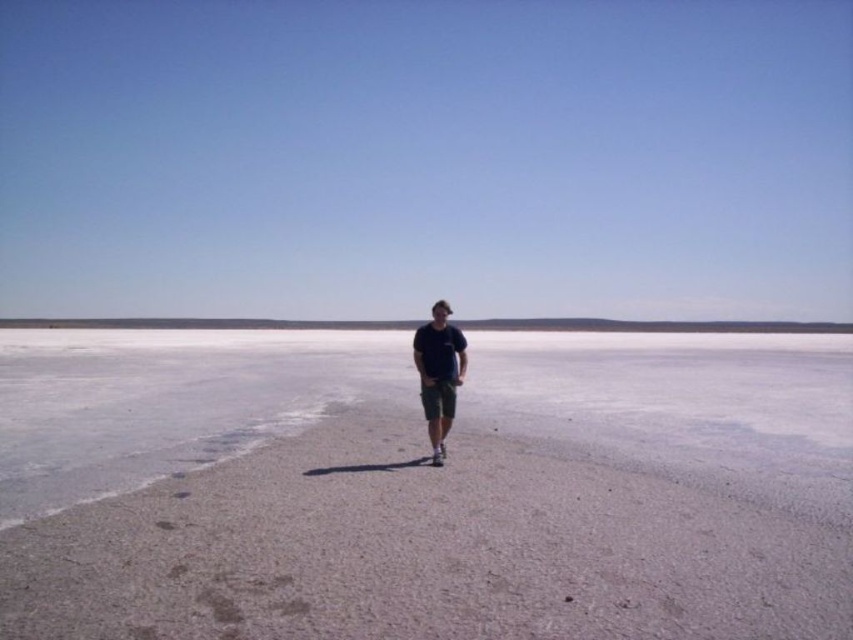
Can you confirm if white sand at center is smaller than green cotton shorts at center?

Incorrect, white sand at center is not smaller in size than green cotton shorts at center.

Locate an element on the screen. The height and width of the screenshot is (640, 853). white sand at center is located at coordinates (424, 486).

I want to click on white sand at center, so tap(424, 486).

Does white sand at center have a greater width compared to matte dark blue shirt at center?

Correct, the width of white sand at center exceeds that of matte dark blue shirt at center.

Who is positioned more to the left, white sand at center or matte dark blue shirt at center?

Positioned to the left is white sand at center.

Locate an element on the screen. The image size is (853, 640). white sand at center is located at coordinates (424, 486).

You are a GUI agent. You are given a task and a screenshot of the screen. Output one action in this format:
    pyautogui.click(x=<x>, y=<y>)
    Task: Click on the white sand at center
    The image size is (853, 640).
    Given the screenshot: What is the action you would take?
    pyautogui.click(x=424, y=486)

Which of these two, matte dark blue shirt at center or green cotton shorts at center, stands shorter?

With less height is green cotton shorts at center.

Is matte dark blue shirt at center positioned before green cotton shorts at center?

Yes, it is.

Is point (444, 406) positioned after point (422, 381)?

That is True.

Locate an element on the screen. matte dark blue shirt at center is located at coordinates (439, 372).